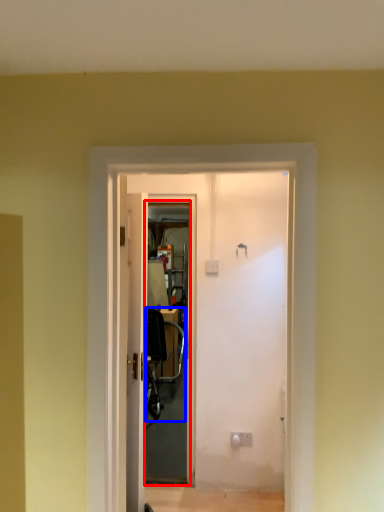
Question: Which point is closer to the camera, screen door (highlighted by a red box) or chair (highlighted by a blue box)?

Choices:
 (A) screen door
 (B) chair

Answer: (A)